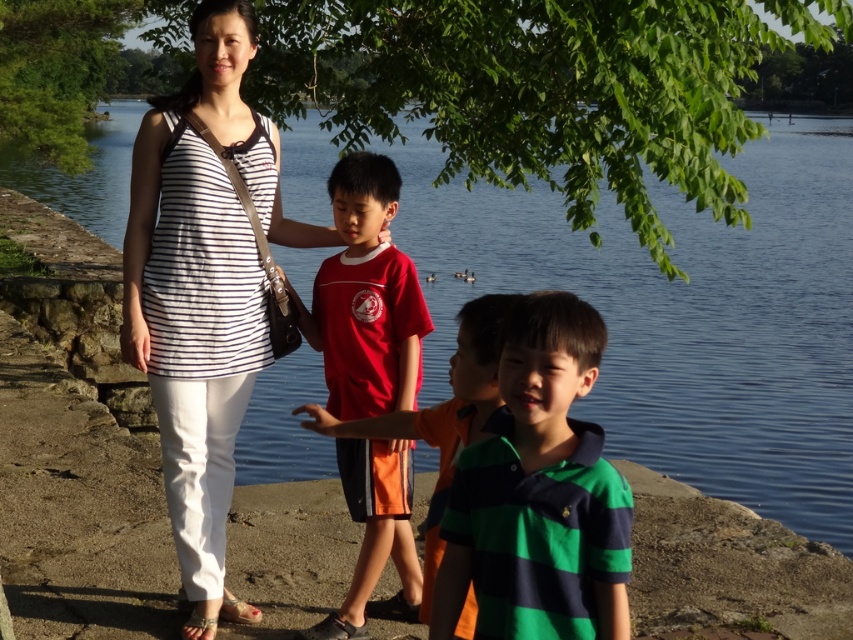
Can you confirm if blue water at center is smaller than orange fabric shirt at center?

Incorrect, blue water at center is not smaller in size than orange fabric shirt at center.

Between blue water at center and orange fabric shirt at center, which one has more height?

blue water at center is taller.

What are the coordinates of `blue water at center` in the screenshot? It's located at (683, 316).

Where is `blue water at center`? This screenshot has height=640, width=853. blue water at center is located at coordinates (683, 316).

Can you confirm if white striped tank top at center is thinner than red cotton shirt at center?

No, white striped tank top at center is not thinner than red cotton shirt at center.

Looking at this image, can you confirm if white striped tank top at center is positioned to the right of red cotton shirt at center?

No, white striped tank top at center is not to the right of red cotton shirt at center.

At what (x,y) coordinates should I click in order to perform the action: click on white striped tank top at center. Please return your answer as a coordinate pair (x, y). The width and height of the screenshot is (853, 640). Looking at the image, I should click on (202, 291).

Does point (462, 298) come farther from viewer compared to point (207, 467)?

Yes, point (462, 298) is behind point (207, 467).

Can you confirm if blue water at center is positioned above white striped tank top at center?

Yes, blue water at center is above white striped tank top at center.

At what (x,y) coordinates should I click in order to perform the action: click on blue water at center. Please return your answer as a coordinate pair (x, y). The height and width of the screenshot is (640, 853). Looking at the image, I should click on (683, 316).

Locate an element on the screen. The image size is (853, 640). blue water at center is located at coordinates (683, 316).